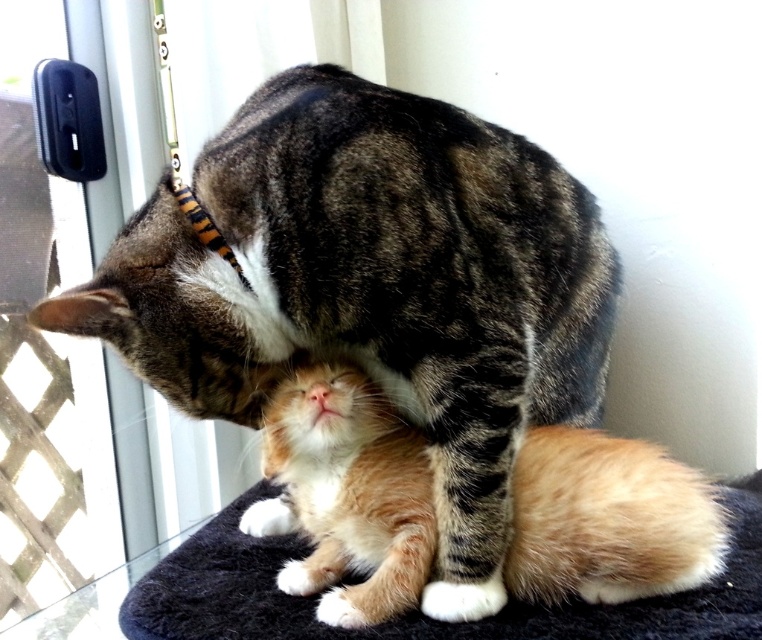
Question: Which object appears farthest from the camera in this image?

Choices:
 (A) black fuzzy mat at lower center
 (B) orange fur kitten at center

Answer: (B)

Question: Considering the real-world distances, which object is farthest from the black fuzzy mat at lower center?

Choices:
 (A) orange fur kitten at center
 (B) tabby fur cat at center

Answer: (B)

Question: Is black fuzzy mat at lower center wider than orange and black striped fabric at upper center?

Choices:
 (A) no
 (B) yes

Answer: (B)

Question: Which point is farther from the camera taking this photo?

Choices:
 (A) (122, 284)
 (B) (314, 524)
 (C) (616, 605)
 (D) (232, 260)

Answer: (A)

Question: Can you confirm if orange fur kitten at center is positioned to the right of orange and black striped fabric at upper center?

Choices:
 (A) no
 (B) yes

Answer: (B)

Question: Does tabby fur cat at center have a greater width compared to black fuzzy mat at lower center?

Choices:
 (A) no
 (B) yes

Answer: (A)